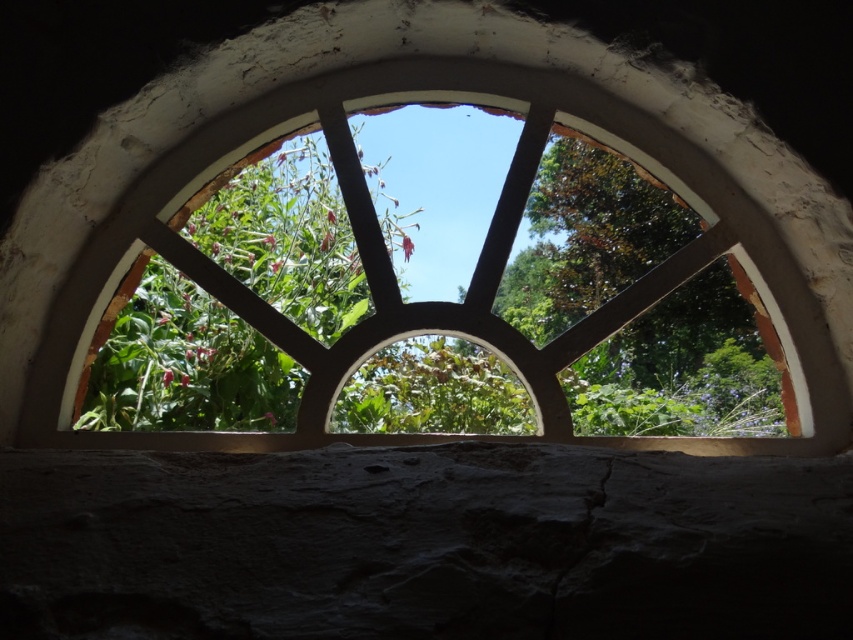
You are an architect analyzing the structural integrity of the wooden at center and green leafy tree at center. Which object is more likely to require immediate maintenance due to its width?

The wooden at center might be wider than green leafy tree at center, so it is more likely to require immediate maintenance due to its width.

You are standing inside a room with the semi circular window. You see the wooden at center and the green leafy tree at center outside. Which object is positioned higher from your viewpoint?

The wooden at center is located above the green leafy tree at center, so it is positioned higher from your viewpoint.